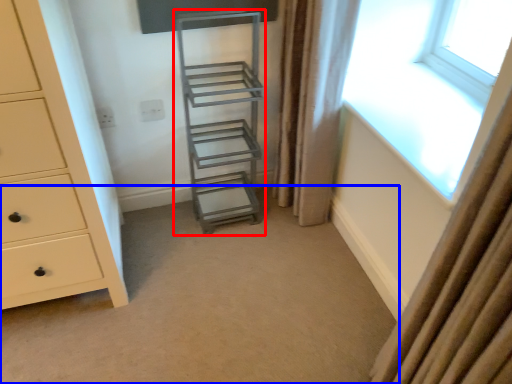
Question: Which object is closer to the camera taking this photo, shelf (highlighted by a red box) or plain (highlighted by a blue box)?

Choices:
 (A) shelf
 (B) plain

Answer: (B)